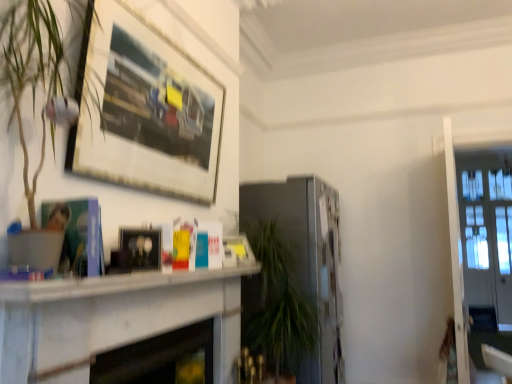
Question: Considering the positions of clear glass door at right and white marble fireplace at center, positioned as the 2th fireplace in back-to-front order, in the image, is clear glass door at right bigger or smaller than white marble fireplace at center, positioned as the 2th fireplace in back-to-front order,?

Choices:
 (A) small
 (B) big

Answer: (B)

Question: In the image, is clear glass door at right positioned in front of or behind white marble fireplace at center, arranged as the 1th fireplace when viewed from the front?

Choices:
 (A) behind
 (B) front

Answer: (A)

Question: Estimate the real-world distances between objects in this image. Which object is closer to the white marble fireplace at center, placed as the 2th fireplace when sorted from right to left?

Choices:
 (A) matte black picture frame at center, which is counted as the first picture frame, starting from the bottom
 (B) white marble fireplace at center
 (C) satin silver fireplace at center, the 2th fireplace in the front-to-back sequence
 (D) clear glass door at right
 (E) wooden picture frame at upper left, which appears as the 1th picture frame when viewed from the top

Answer: (B)

Question: Considering the real-world distances, which object is farthest from the wooden picture frame at upper left, which is the 2th picture frame in bottom-to-top order?

Choices:
 (A) clear glass door at right
 (B) white marble fireplace at center, positioned as the 2th fireplace in back-to-front order
 (C) white marble fireplace at center
 (D) matte black picture frame at center, which is counted as the first picture frame, starting from the bottom
 (E) satin silver fireplace at center, the first fireplace viewed from the back

Answer: (A)